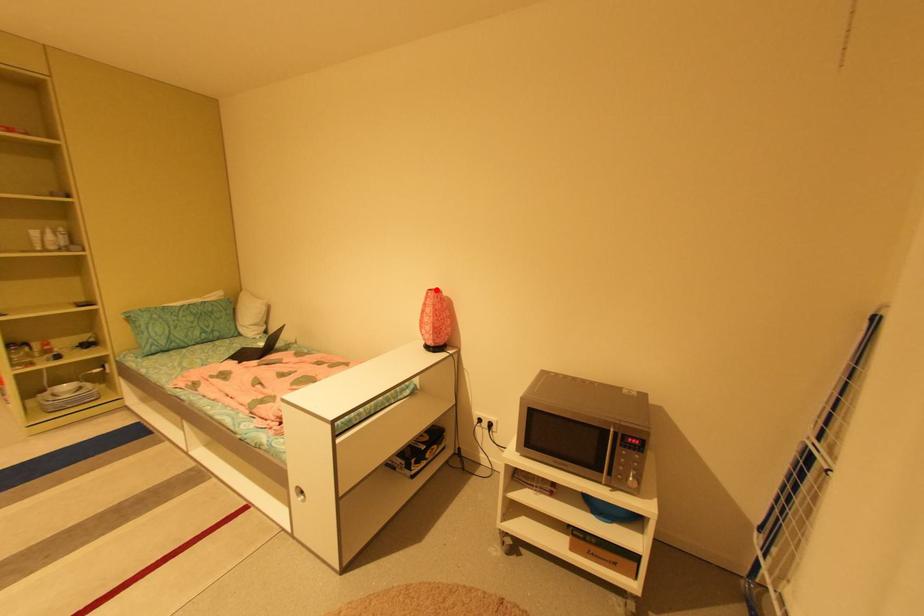
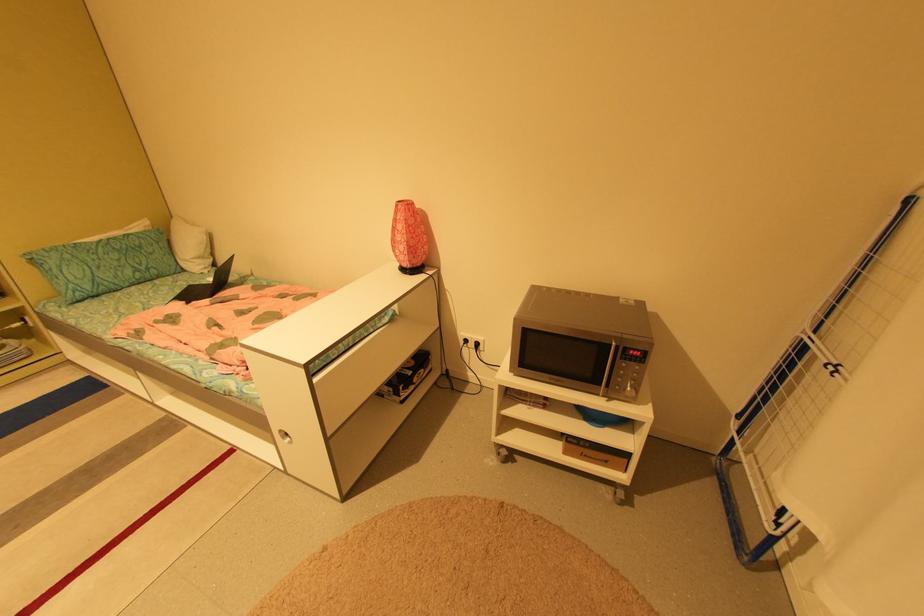
Find the pixel in the second image that matches the highlighted location in the first image.

(406, 201)